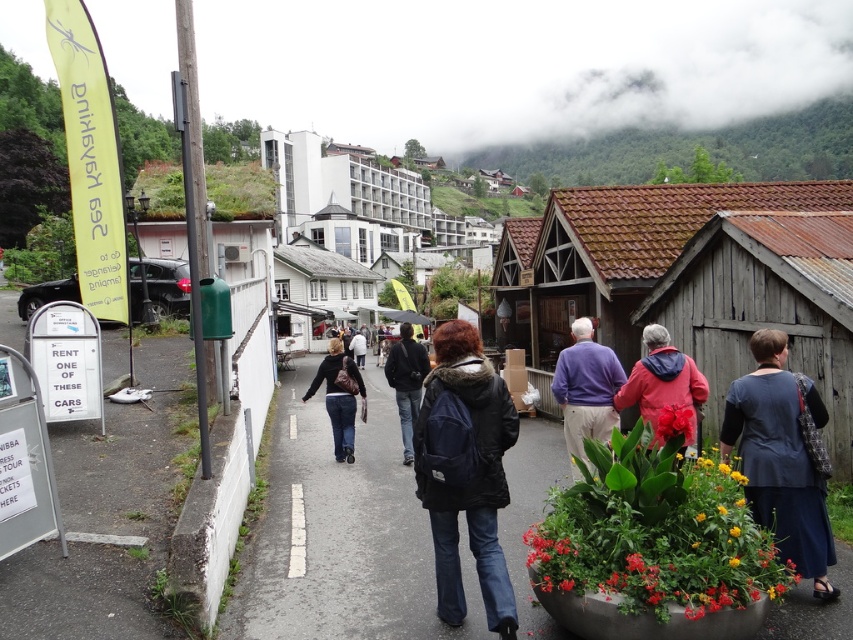
Who is positioned more to the left, green grassy hillside at upper center or matte black jacket at center?

matte black jacket at center is more to the left.

Does point (659, 160) lie behind point (323, 362)?

Yes, point (659, 160) is farther from viewer.

Between point (573, 177) and point (337, 436), which one is positioned behind?

Point (573, 177)

I want to click on green grassy hillside at upper center, so pyautogui.click(x=691, y=150).

Who is positioned more to the left, green grassy hillside at upper center or dark blue jacket at center?

dark blue jacket at center is more to the left.

Can you confirm if green grassy hillside at upper center is shorter than dark blue jacket at center?

No.

In order to click on green grassy hillside at upper center in this screenshot , I will do `click(691, 150)`.

Is point (631, 481) closer to camera compared to point (759, 173)?

That is True.

Find the location of a particular element. This screenshot has height=640, width=853. red matte flower pot at lower right is located at coordinates (654, 532).

Is point (608, 467) positioned before point (791, 166)?

Yes.

Find the location of a particular element. The width and height of the screenshot is (853, 640). red matte flower pot at lower right is located at coordinates (654, 532).